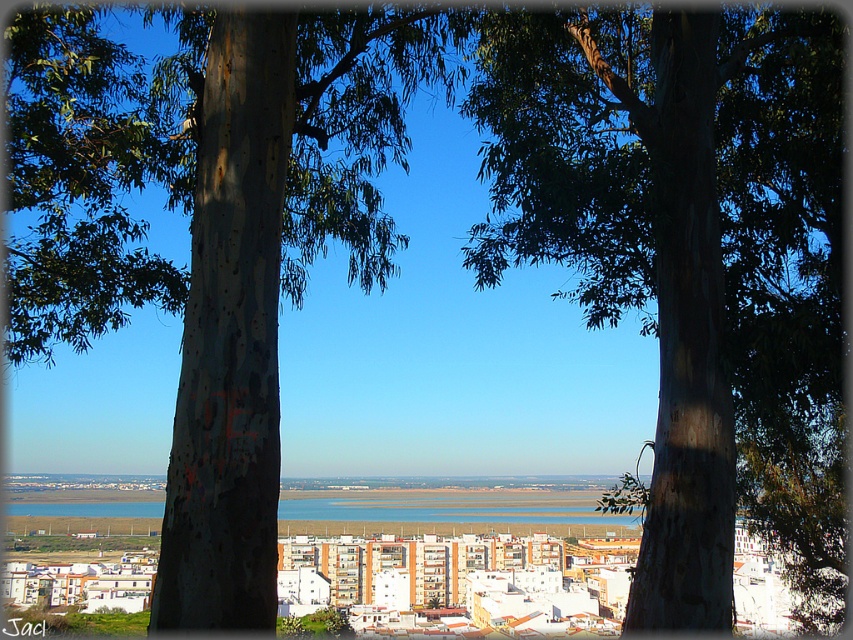
Question: Which is farther from the smooth bark tree at center?

Choices:
 (A) brown rough bark tree at center
 (B) blue water at center

Answer: (A)

Question: Considering the real-world distances, which object is farthest from the smooth bark tree at center?

Choices:
 (A) blue water at center
 (B) brown rough bark tree at center

Answer: (B)

Question: Which object is the farthest from the smooth bark tree at center?

Choices:
 (A) brown rough bark tree at center
 (B) blue water at center

Answer: (A)

Question: Can you confirm if brown rough bark tree at center is positioned to the left of smooth bark tree at center?

Choices:
 (A) yes
 (B) no

Answer: (B)

Question: Can you confirm if smooth bark tree at center is wider than blue water at center?

Choices:
 (A) yes
 (B) no

Answer: (B)

Question: Is smooth bark tree at center smaller than blue water at center?

Choices:
 (A) yes
 (B) no

Answer: (B)